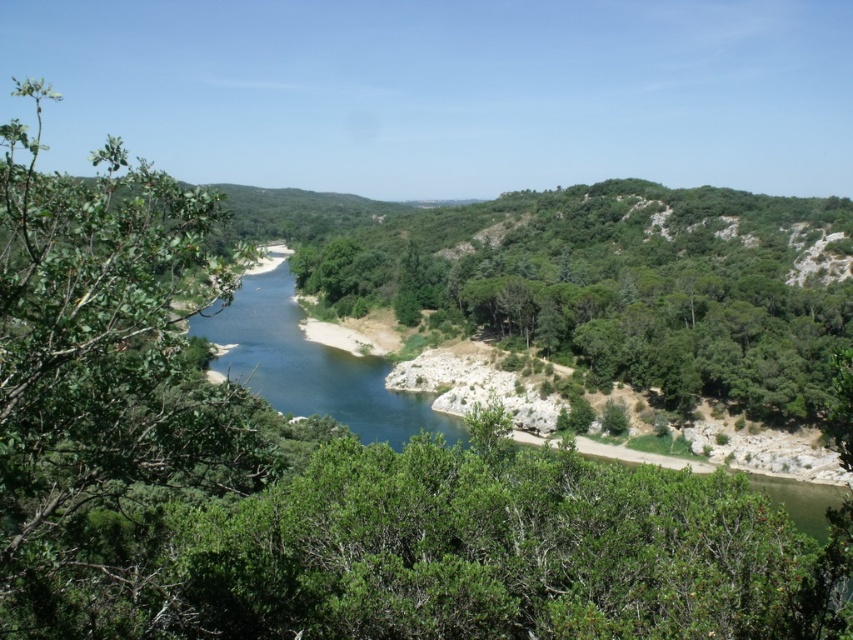
Is blue water at center closer to camera compared to blue smooth river at center?

Yes, blue water at center is closer to the viewer.

Does point (350, 387) come in front of point (334, 408)?

No, (350, 387) is behind (334, 408).

Describe the element at coordinates (311, 364) in the screenshot. I see `blue water at center` at that location.

This screenshot has width=853, height=640. What are the coordinates of `blue water at center` in the screenshot? It's located at (311, 364).